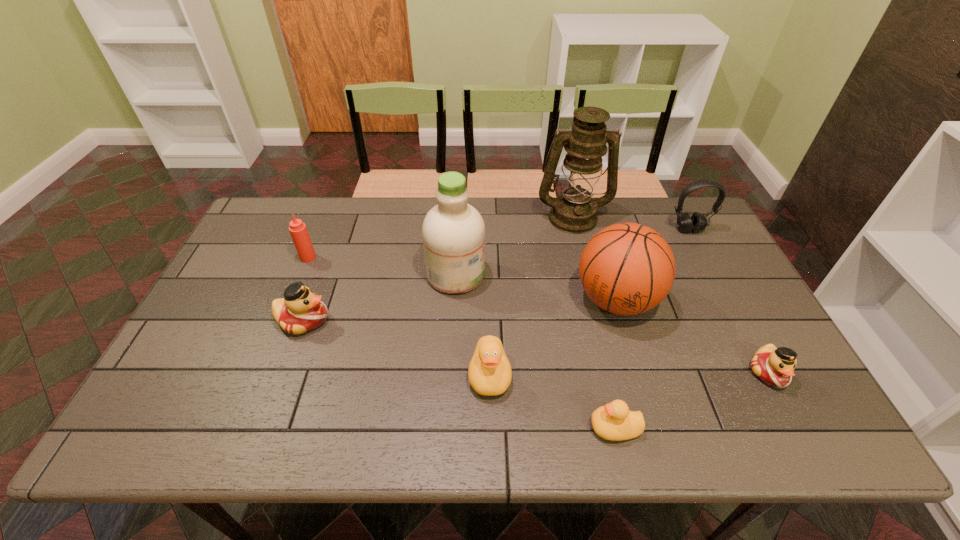
At what (x,y) coordinates should I click in order to perform the action: click on free space that satisfies the following two spatial constraints: 1. on the front side of the orange basketball; 2. on the face of the second duck from right to left. Please return your answer as a coordinate pair (x, y). The width and height of the screenshot is (960, 540). Looking at the image, I should click on (653, 428).